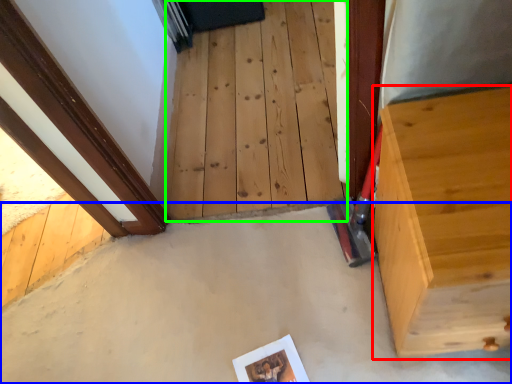
Question: Which object is positioned farthest from furniture (highlighted by a red box)? Select from concrete (highlighted by a blue box) and stairwell (highlighted by a green box).

Choices:
 (A) concrete
 (B) stairwell

Answer: (B)